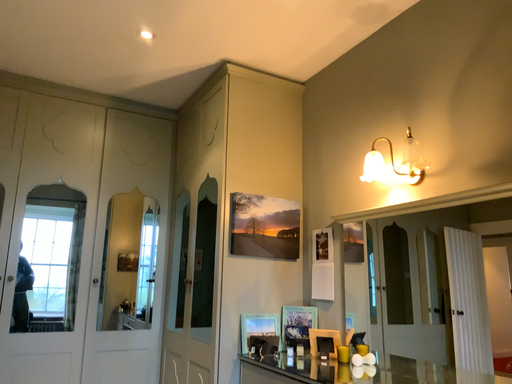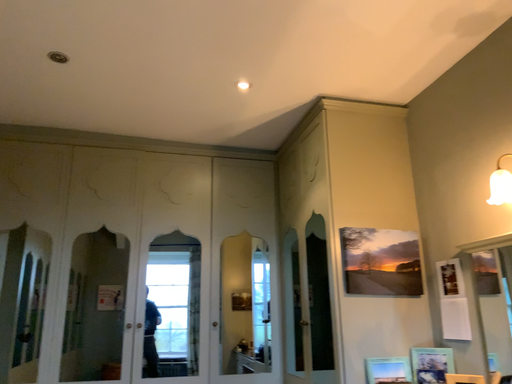
Question: Which way did the camera rotate in the video?

Choices:
 (A) rotated left
 (B) rotated right

Answer: (A)